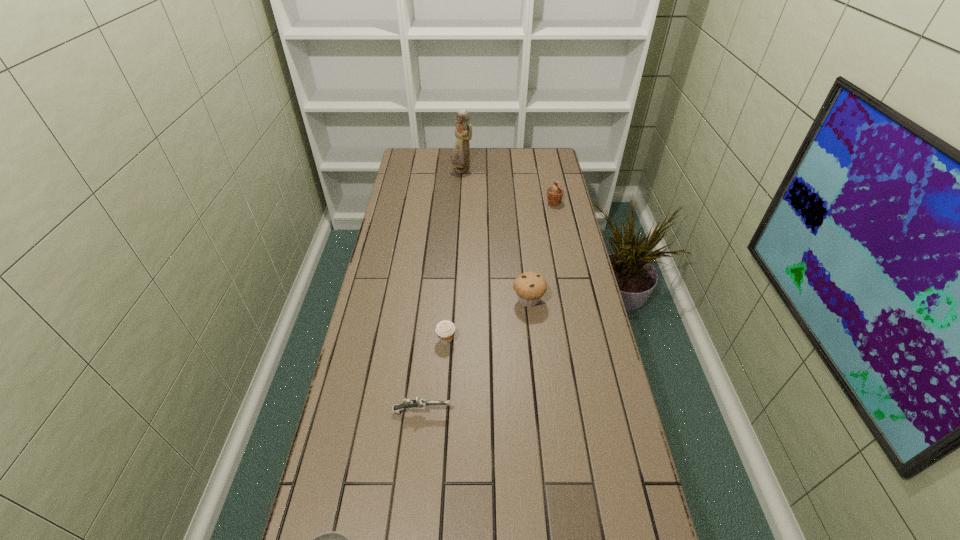
The width and height of the screenshot is (960, 540). Identify the location of the tallest object. (460, 158).

At what (x,y) coordinates should I click in order to perform the action: click on figurine. Please return your answer as a coordinate pair (x, y). Looking at the image, I should click on (460, 158).

Find the location of a particular element. This screenshot has width=960, height=540. the fifth object from left to right is located at coordinates (530, 286).

Locate an element on the screen. The height and width of the screenshot is (540, 960). the second muffin from left to right is located at coordinates (530, 286).

The height and width of the screenshot is (540, 960). Identify the location of the rightmost muffin. (x=554, y=194).

Identify the location of the second farthest object. The width and height of the screenshot is (960, 540). (554, 194).

You are a GUI agent. You are given a task and a screenshot of the screen. Output one action in this format:
    pyautogui.click(x=<x>, y=<y>)
    Task: Click on the leftmost muffin
    
    Given the screenshot: What is the action you would take?
    (445, 330)

I want to click on the third nearest object, so click(x=445, y=330).

I want to click on the fifth tallest object, so click(x=419, y=403).

The width and height of the screenshot is (960, 540). In order to click on the fifth farthest object in this screenshot , I will do `click(419, 403)`.